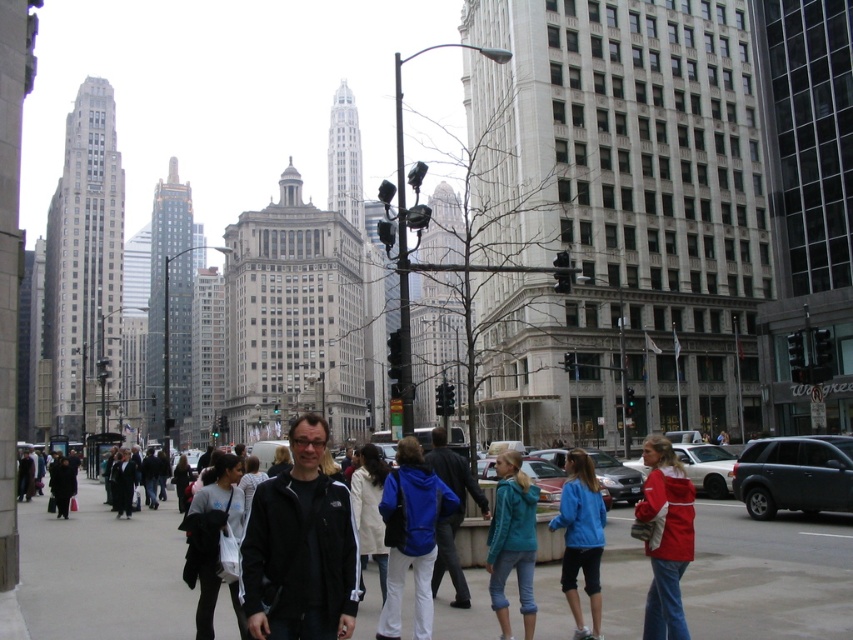
You are a photographer trying to capture the man in the black matte jacket at center. The camera you are using has a focal length of 50mm. To ensure the jacket is in focus, you need to know its position relative to the camera. Can you determine if the jacket is positioned within the camera sensor area, which is defined as the rectangle from coordinates 0.0 to 1.0 on both axes?

The black matte jacket at center is located at point (300,547), which falls within the camera sensor area coordinates of 0.0 to 1.0 on both axes. Therefore, the jacket is positioned within the sensor area and should be in focus.